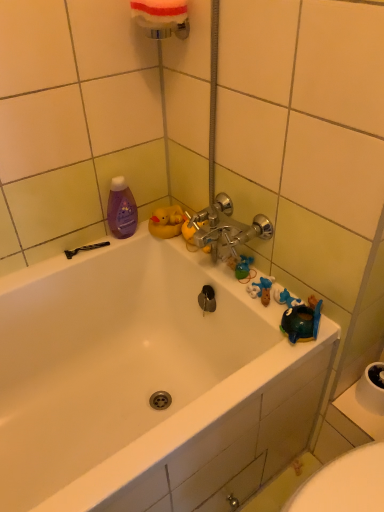
Where is `vacant space to the right of black plastic razor at lower left`? The width and height of the screenshot is (384, 512). vacant space to the right of black plastic razor at lower left is located at coordinates (136, 238).